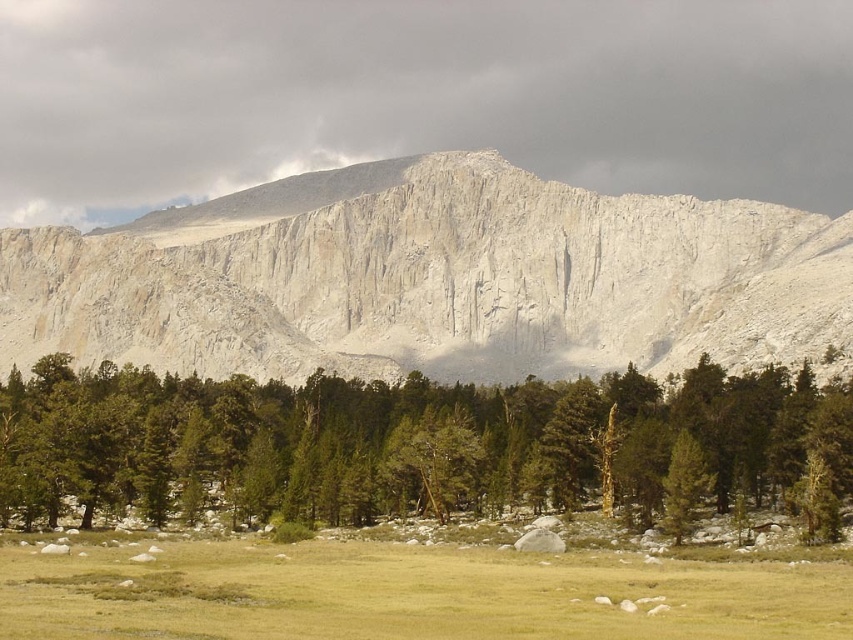
You are a hiker standing at the starting point of a trail. You see the white rock mountain at center in the distance. If your GPS says you are exactly 243 meters away from it, can you confirm if you are at the starting point of the trail?

The white rock mountain at center is 243.05 meters away from the camera. Since your GPS shows 243 meters, which is very close to the actual distance, you are likely at the starting point of the trail.

You are planning a hiking route through the meadow and want to ensure you can see the white rock mountain at center from your path. Given that the green textured pine trees at lower center are between you and the mountain, will the trees block your view of the mountain?

The white rock mountain at center is bigger than the green textured pine trees at lower center, so the mountain will likely be visible above the trees.